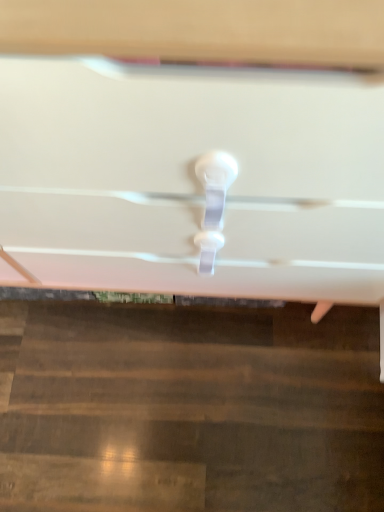
The width and height of the screenshot is (384, 512). I want to click on white plastic drawer handle at center, so click(x=194, y=150).

What do you see at coordinates (194, 150) in the screenshot? I see `white plastic drawer handle at center` at bounding box center [194, 150].

You are a GUI agent. You are given a task and a screenshot of the screen. Output one action in this format:
    pyautogui.click(x=<x>, y=<y>)
    Task: Click on the white plastic drawer handle at center
    
    Given the screenshot: What is the action you would take?
    pyautogui.click(x=194, y=150)